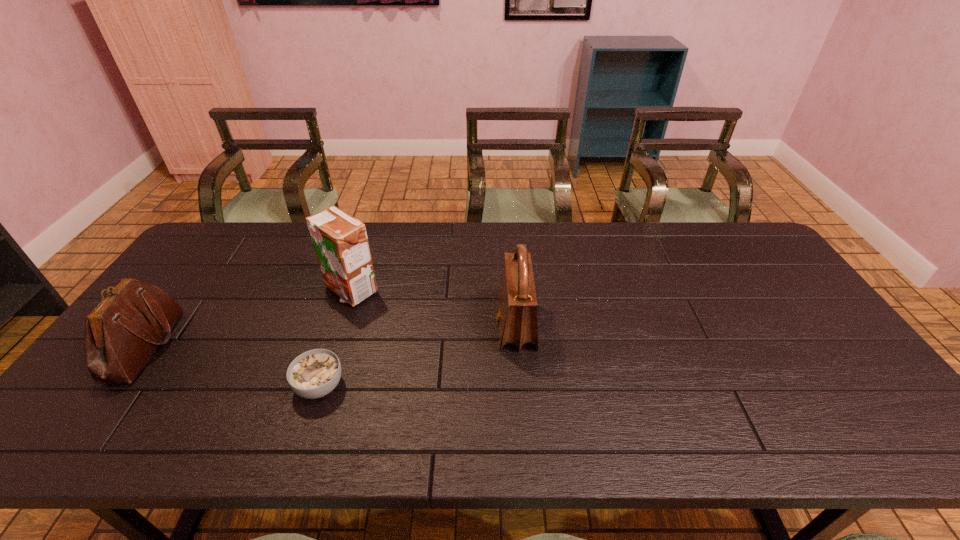
The height and width of the screenshot is (540, 960). Find the location of `vacant space that satisfies the following two spatial constraints: 1. on the front flap of the rightmost object; 2. on the front side of the left shoulder bag`. vacant space that satisfies the following two spatial constraints: 1. on the front flap of the rightmost object; 2. on the front side of the left shoulder bag is located at coordinates (517, 346).

Find the location of a particular element. This screenshot has width=960, height=540. vacant space that satisfies the following two spatial constraints: 1. on the straw side of the soup bowl; 2. on the right side of the carton is located at coordinates (320, 386).